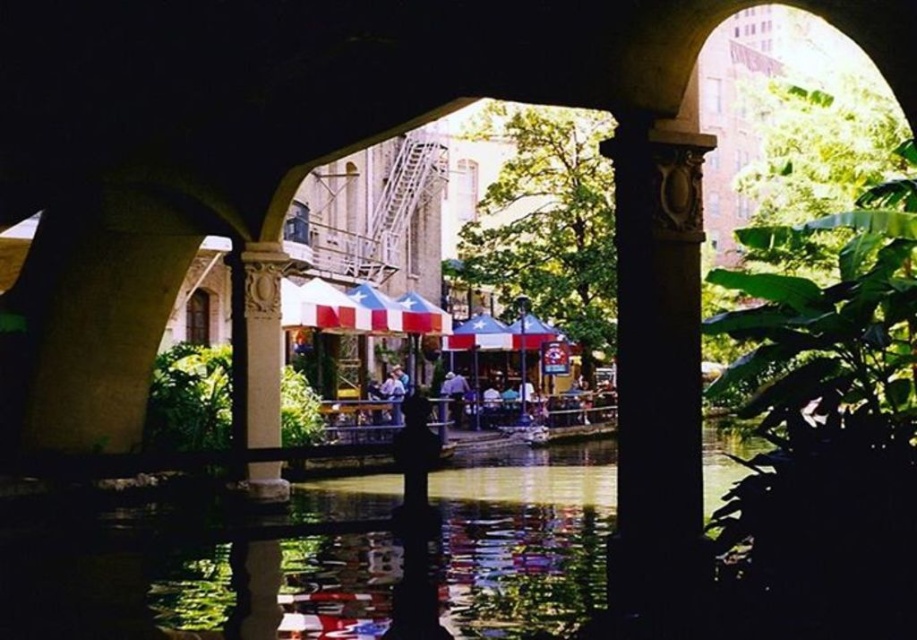
Who is more forward, (518, 492) or (622, 476)?

Point (622, 476)

Describe the element at coordinates (163, 563) in the screenshot. I see `green reflective water at center` at that location.

Does point (212, 516) come in front of point (642, 593)?

No, (212, 516) is further to viewer.

Locate an element on the screen. The width and height of the screenshot is (917, 640). green reflective water at center is located at coordinates (163, 563).

Between carved stone column at center and white stone column at center, which one appears on the right side from the viewer's perspective?

From the viewer's perspective, carved stone column at center appears more on the right side.

Does carved stone column at center appear on the right side of white stone column at center?

Indeed, carved stone column at center is positioned on the right side of white stone column at center.

This screenshot has width=917, height=640. Describe the element at coordinates (657, 372) in the screenshot. I see `carved stone column at center` at that location.

This screenshot has height=640, width=917. I want to click on carved stone column at center, so click(x=657, y=372).

Who is positioned more to the left, green reflective water at center or white stone column at center?

Positioned to the left is white stone column at center.

Is point (383, 502) closer to viewer compared to point (279, 371)?

Yes.

Is point (192, 522) farther from camera compared to point (274, 272)?

No, (192, 522) is closer to viewer.

This screenshot has width=917, height=640. I want to click on green reflective water at center, so click(x=163, y=563).